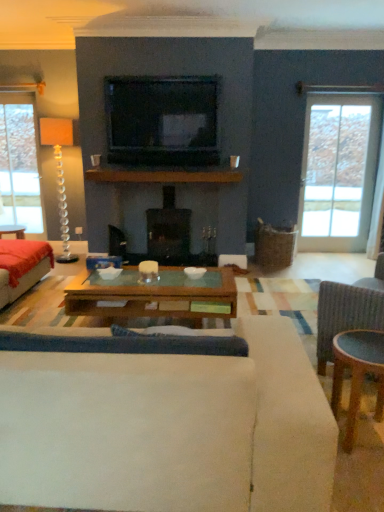
Where is `vacant space situated above black glossy television at upper center (from a real-world perspective)`? The width and height of the screenshot is (384, 512). vacant space situated above black glossy television at upper center (from a real-world perspective) is located at coordinates (161, 77).